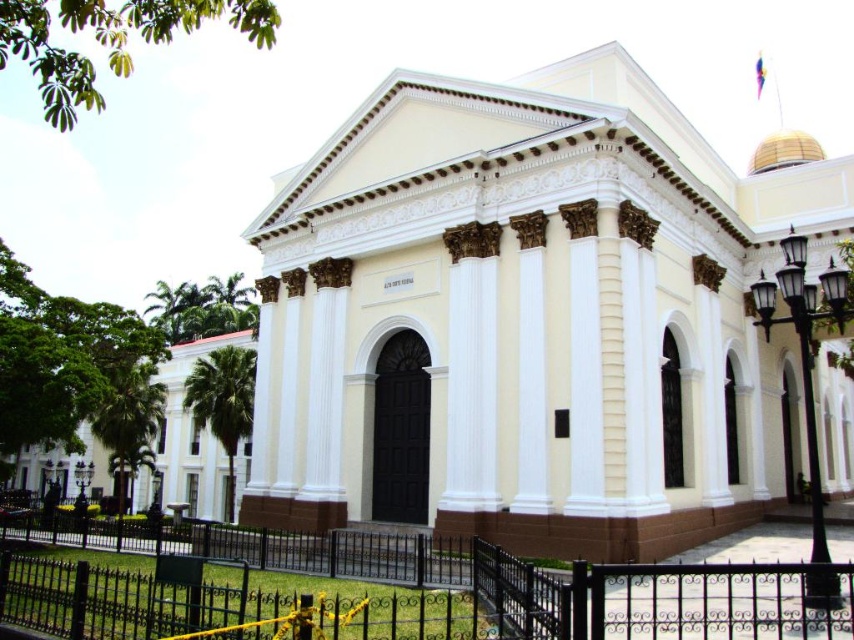
You are standing in front of the white smooth building at center and want to walk to the black wrought iron fence at lower center. In which direction should you move to reach the fence?

The white smooth building at center is positioned on the right side of the black wrought iron fence at lower center, so you should move to your left to reach the fence.

You are standing in front of the grand neoclassical building and want to walk from point A to point B. Point A is located at coordinates point (607, 132) and point B is at point (108, 621). Considering the building layout described, will you have to go around the building to reach point B from point A?

Point (607, 132) is behind point (108, 621), so to reach point B from point A, you would need to go around the building since point A is located behind point B relative to the observer.